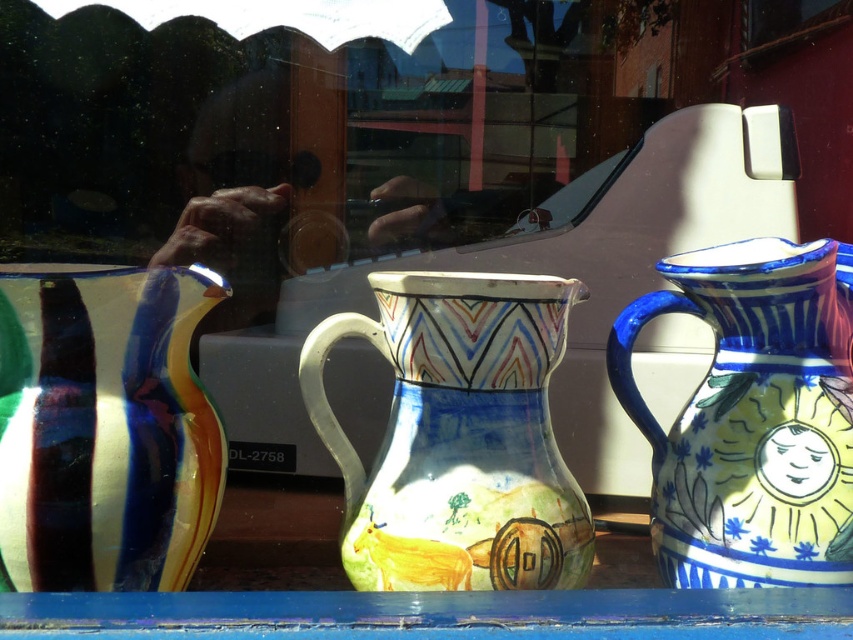
Which is more to the left, hand-painted ceramic jug at center or shiny ceramic jug at left?

Positioned to the left is shiny ceramic jug at left.

Is hand-painted ceramic jug at center smaller than shiny ceramic jug at left?

No.

Is point (575, 552) positioned after point (62, 371)?

Yes.

Where is `hand-painted ceramic jug at center`? This screenshot has height=640, width=853. hand-painted ceramic jug at center is located at coordinates (457, 436).

Is shiny ceramic jug at left behind blue glazed jug at right?

No, it is in front of blue glazed jug at right.

Is shiny ceramic jug at left thinner than blue glazed jug at right?

Correct, shiny ceramic jug at left's width is less than blue glazed jug at right's.

Identify the location of shiny ceramic jug at left. This screenshot has height=640, width=853. (105, 429).

Does blue glazed jug at right appear over blue painted wood at lower center?

Yes, blue glazed jug at right is above blue painted wood at lower center.

Can you confirm if blue glazed jug at right is thinner than blue painted wood at lower center?

Indeed, blue glazed jug at right has a lesser width compared to blue painted wood at lower center.

Between point (724, 552) and point (221, 596), which one is positioned in front?

Point (221, 596) is in front.

Where is `blue glazed jug at right`? blue glazed jug at right is located at coordinates (753, 417).